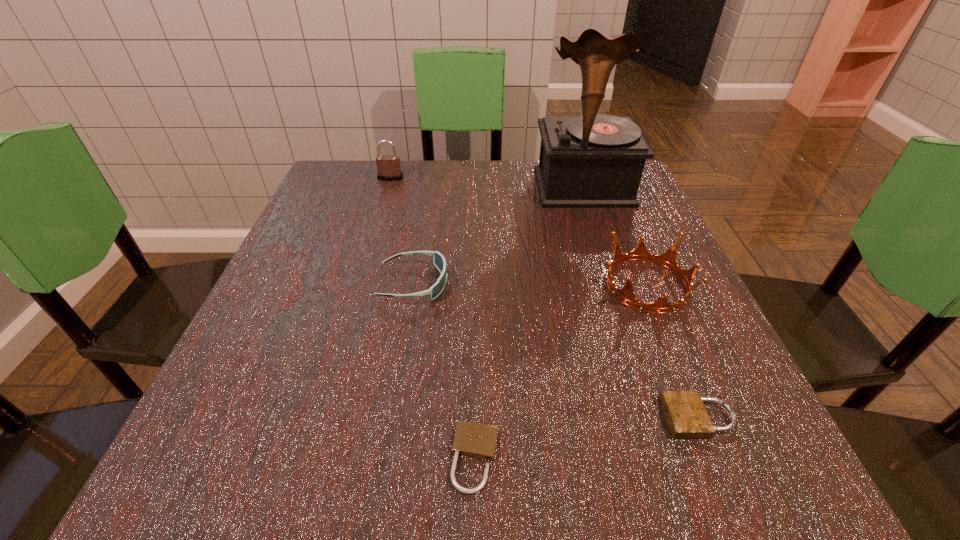
In order to click on vacant space located 0.340m at the horn opening of the tallest object in this screenshot , I will do `click(628, 320)`.

What are the coordinates of `free spot located 0.100m on the right of the leftmost object` in the screenshot? It's located at (443, 178).

The width and height of the screenshot is (960, 540). I want to click on free space located on the left of the crown, so click(x=526, y=285).

This screenshot has width=960, height=540. Identify the location of vacant position located 0.190m on the front-facing side of the second object from left to right. (551, 284).

Identify the location of free space located 0.270m on the keyhole side of the second shortest object. Image resolution: width=960 pixels, height=540 pixels. (470, 417).

Where is `free point located on the keyhole side of the second shortest object`? The image size is (960, 540). free point located on the keyhole side of the second shortest object is located at coordinates (536, 417).

Locate an element on the screen. This screenshot has height=540, width=960. free space located 0.050m on the keyhole side of the second shortest object is located at coordinates pos(629,417).

At what (x,y) coordinates should I click in order to perform the action: click on vacant position located on the back of the shortest object. Please return your answer as a coordinate pair (x, y). This screenshot has width=960, height=540. Looking at the image, I should click on pyautogui.click(x=476, y=382).

Where is `phonograph_record that is at the far edge`? Image resolution: width=960 pixels, height=540 pixels. phonograph_record that is at the far edge is located at coordinates (594, 160).

Where is `padlock situated at the far edge`? The image size is (960, 540). padlock situated at the far edge is located at coordinates (388, 166).